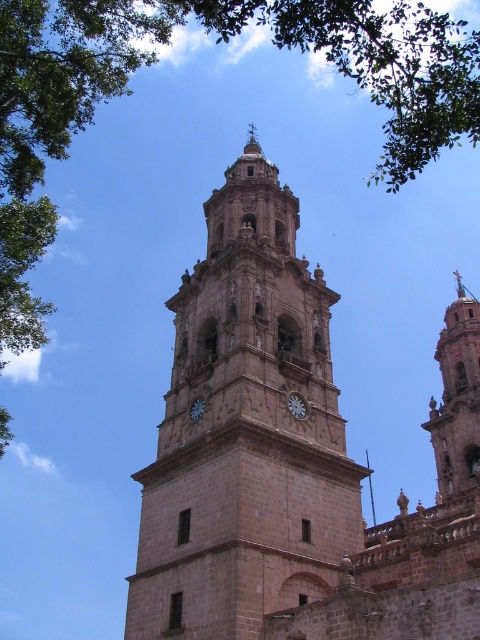
Looking at this image, can you confirm if green leafy tree at upper left is shorter than white stone clock at center?

No, green leafy tree at upper left is not shorter than white stone clock at center.

Does green leafy tree at upper left appear on the right side of white stone clock at center?

Yes, green leafy tree at upper left is to the right of white stone clock at center.

You are a GUI agent. You are given a task and a screenshot of the screen. Output one action in this format:
    pyautogui.click(x=<x>, y=<y>)
    Task: Click on the green leafy tree at upper left
    
    Given the screenshot: What is the action you would take?
    pyautogui.click(x=216, y=38)

You are a GUI agent. You are given a task and a screenshot of the screen. Output one action in this format:
    pyautogui.click(x=<x>, y=<y>)
    Task: Click on the green leafy tree at upper left
    This screenshot has height=640, width=480.
    Given the screenshot: What is the action you would take?
    pyautogui.click(x=216, y=38)

Is green leafy tree at upper left bigger than smooth stone tower at right?

Indeed, green leafy tree at upper left has a larger size compared to smooth stone tower at right.

Can you confirm if green leafy tree at upper left is positioned below smooth stone tower at right?

No, green leafy tree at upper left is not below smooth stone tower at right.

Between point (414, 48) and point (445, 493), which one is positioned behind?

Positioned behind is point (445, 493).

The height and width of the screenshot is (640, 480). Find the location of `green leafy tree at upper left`. green leafy tree at upper left is located at coordinates (216, 38).

Does brown stone clock tower at center appear over matte gray clock at center?

Correct, brown stone clock tower at center is located above matte gray clock at center.

Which is behind, point (224, 291) or point (302, 404)?

The point (224, 291) is behind.

Does point (298, 371) come farther from viewer compared to point (300, 412)?

Yes, point (298, 371) is behind point (300, 412).

Identify the location of brown stone clock tower at center. (245, 432).